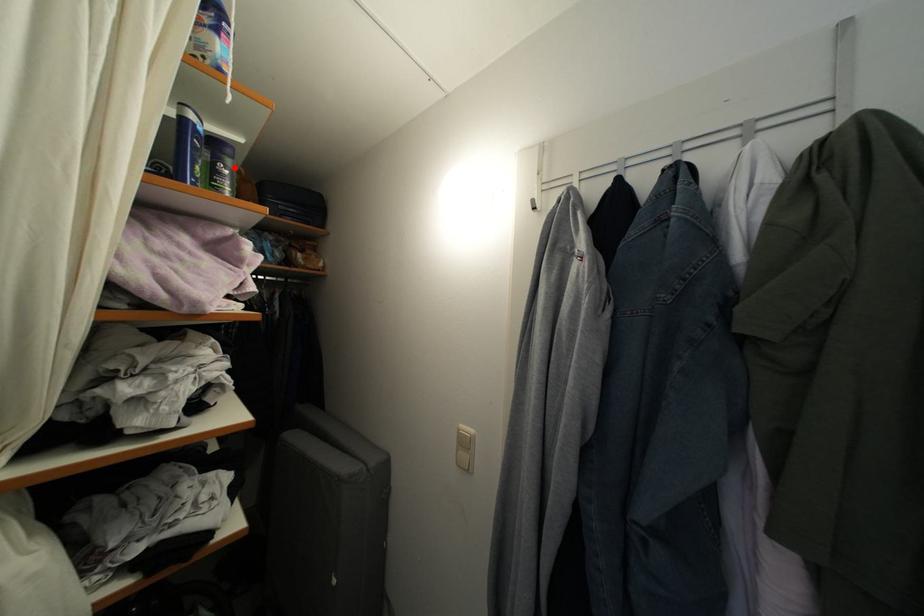
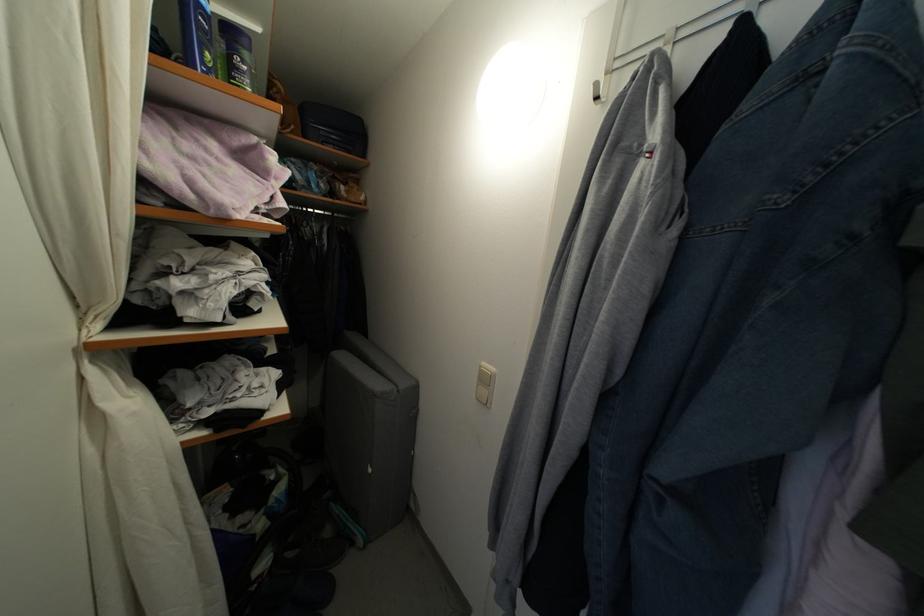
Where in the second image is the point corresponding to the highlighted location from the first image?

(251, 61)